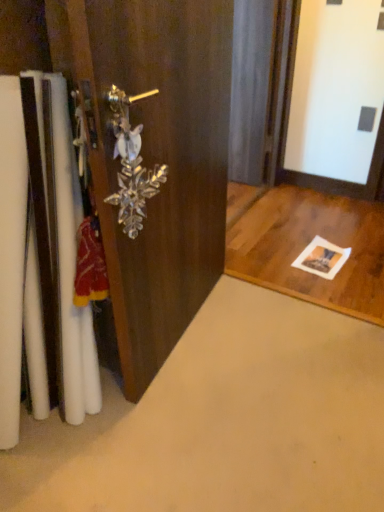
Question: Is clear crystal handle at center aimed at wooden door handle at left?

Choices:
 (A) no
 (B) yes

Answer: (B)

Question: Is clear crystal handle at center far from wooden door handle at left?

Choices:
 (A) yes
 (B) no

Answer: (B)

Question: Does clear crystal handle at center have a greater height compared to wooden door handle at left?

Choices:
 (A) no
 (B) yes

Answer: (A)

Question: Does clear crystal handle at center come in front of wooden door handle at left?

Choices:
 (A) yes
 (B) no

Answer: (B)

Question: Does clear crystal handle at center contain wooden door handle at left?

Choices:
 (A) yes
 (B) no

Answer: (B)

Question: Can you confirm if clear crystal handle at center is positioned to the left of wooden door handle at left?

Choices:
 (A) no
 (B) yes

Answer: (B)

Question: Is wooden door handle at left bigger than clear crystal handle at center?

Choices:
 (A) yes
 (B) no

Answer: (A)

Question: Does wooden door handle at left have a lesser height compared to clear crystal handle at center?

Choices:
 (A) yes
 (B) no

Answer: (B)

Question: Is wooden door handle at left smaller than clear crystal handle at center?

Choices:
 (A) no
 (B) yes

Answer: (A)

Question: Is wooden door handle at left wider than clear crystal handle at center?

Choices:
 (A) yes
 (B) no

Answer: (A)

Question: Can you confirm if wooden door handle at left is taller than clear crystal handle at center?

Choices:
 (A) yes
 (B) no

Answer: (A)

Question: From a real-world perspective, does wooden door handle at left stand above clear crystal handle at center?

Choices:
 (A) yes
 (B) no

Answer: (B)

Question: Considering the relative positions of wooden door handle at left and clear crystal handle at center in the image provided, is wooden door handle at left to the left or to the right of clear crystal handle at center?

Choices:
 (A) right
 (B) left

Answer: (A)